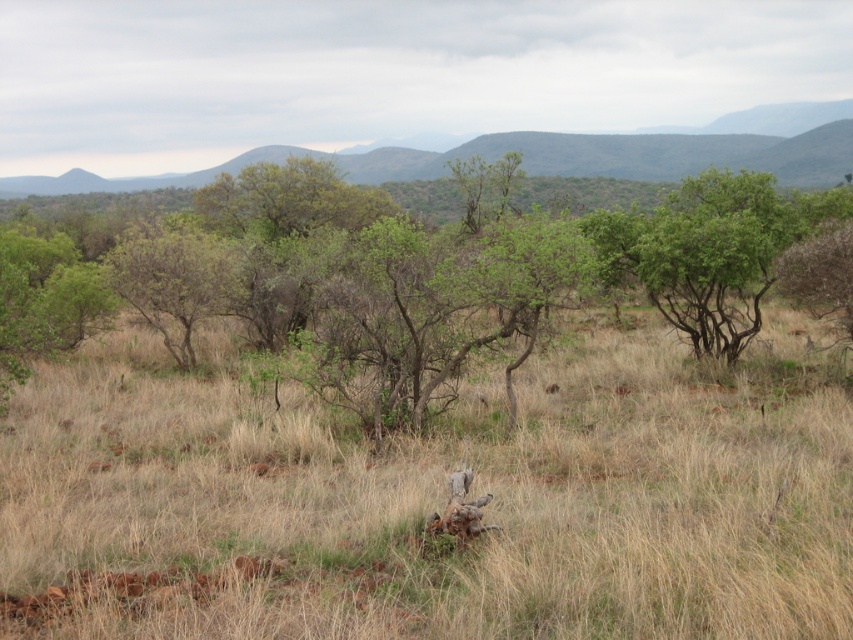
Question: Among these objects, which one is farthest from the camera?

Choices:
 (A) green leafy shrub at center
 (B) green leafy tree at center

Answer: (A)

Question: Does green leafy tree at center appear over green leafy shrub at center?

Choices:
 (A) no
 (B) yes

Answer: (B)

Question: Does green leafy tree at center appear on the left side of green leafy shrub at center?

Choices:
 (A) no
 (B) yes

Answer: (A)

Question: Can you confirm if green leafy tree at center is wider than green leafy shrub at center?

Choices:
 (A) no
 (B) yes

Answer: (B)